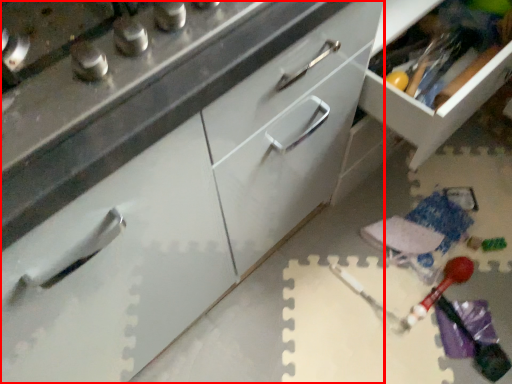
Question: In this image, where is cabinetry (annotated by the red box) located relative to cabinetry?

Choices:
 (A) right
 (B) left

Answer: (B)